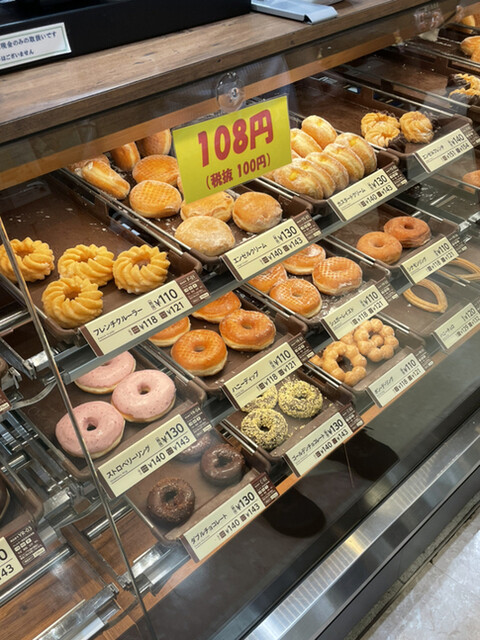
Where is `glass donut case display`? glass donut case display is located at coordinates (61, 192).